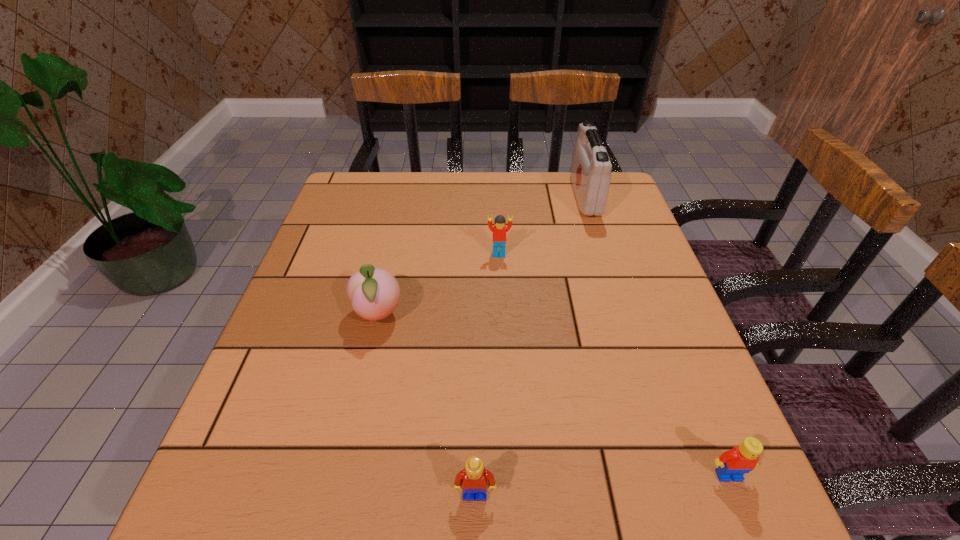
Image resolution: width=960 pixels, height=540 pixels. In order to click on the first-aid kit in this screenshot , I will do `click(591, 168)`.

Find the location of a particular element. The height and width of the screenshot is (540, 960). the tallest object is located at coordinates (591, 168).

Locate an element on the screen. Image resolution: width=960 pixels, height=540 pixels. the leftmost object is located at coordinates (374, 293).

Identify the location of the third farthest object. pos(374,293).

Locate an element on the screen. This screenshot has height=540, width=960. the farthest Lego is located at coordinates (499, 230).

The width and height of the screenshot is (960, 540). Find the location of `the nearest object`. the nearest object is located at coordinates (474, 478).

Identify the location of the second nearest Lego. The width and height of the screenshot is (960, 540). (732, 464).

Find the location of a particular element. Image resolution: width=960 pixels, height=540 pixels. the rightmost object is located at coordinates (732, 464).

The image size is (960, 540). Find the location of `vacant space located 0.150m on the front side of the tallest object`. vacant space located 0.150m on the front side of the tallest object is located at coordinates (523, 197).

Where is `free region located 0.300m on the front side of the tallest object`? free region located 0.300m on the front side of the tallest object is located at coordinates pos(472,197).